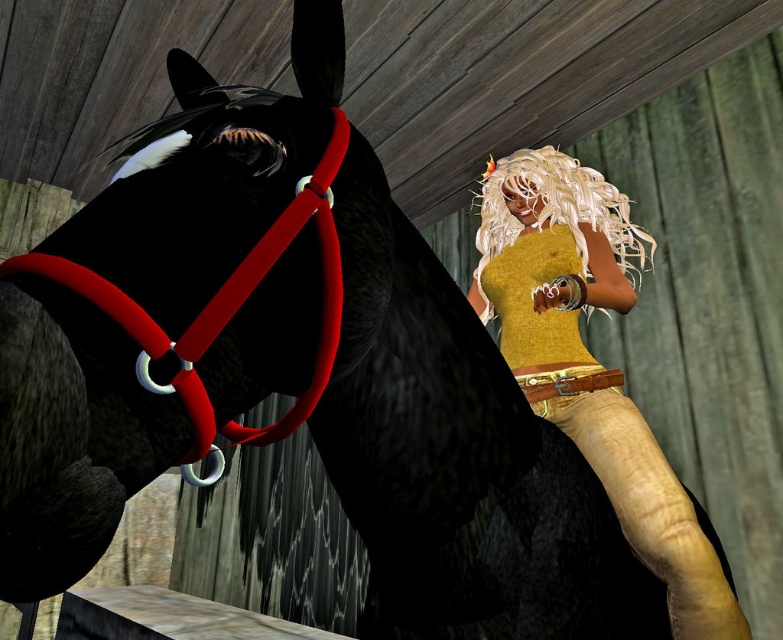
Question: Which of the following is the closest to the observer?

Choices:
 (A) blonde hair wig at upper right
 (B) matte yellow tank top at center

Answer: (B)

Question: Which point is closer to the camera?

Choices:
 (A) blonde hair wig at upper right
 (B) matte yellow tank top at center

Answer: (B)

Question: Is matte yellow tank top at center positioned behind blonde hair wig at upper right?

Choices:
 (A) no
 (B) yes

Answer: (A)

Question: Which object appears closest to the camera in this image?

Choices:
 (A) blonde hair wig at upper right
 (B) matte yellow tank top at center

Answer: (B)

Question: In this image, where is matte yellow tank top at center located relative to blonde hair wig at upper right?

Choices:
 (A) left
 (B) right

Answer: (A)

Question: Can you confirm if matte yellow tank top at center is positioned above blonde hair wig at upper right?

Choices:
 (A) no
 (B) yes

Answer: (A)